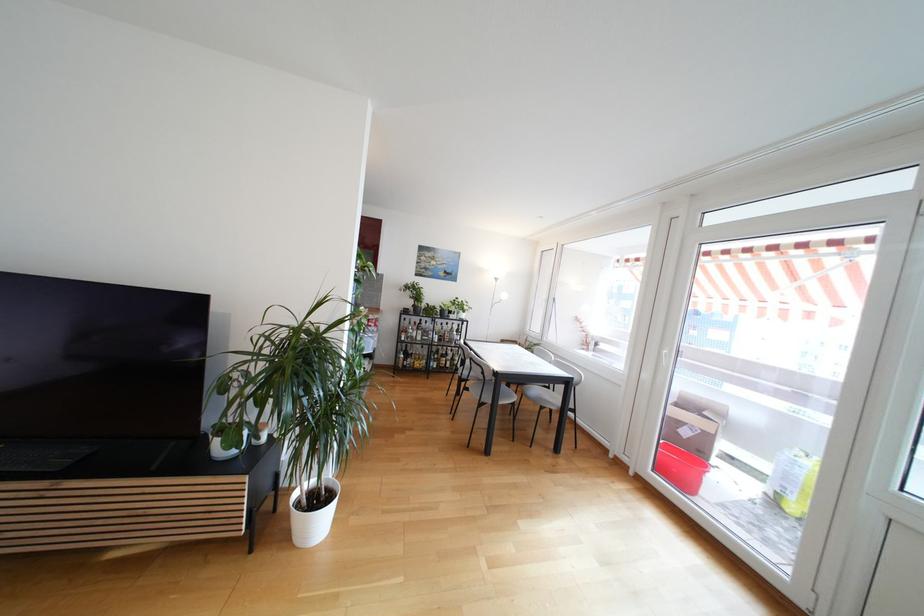
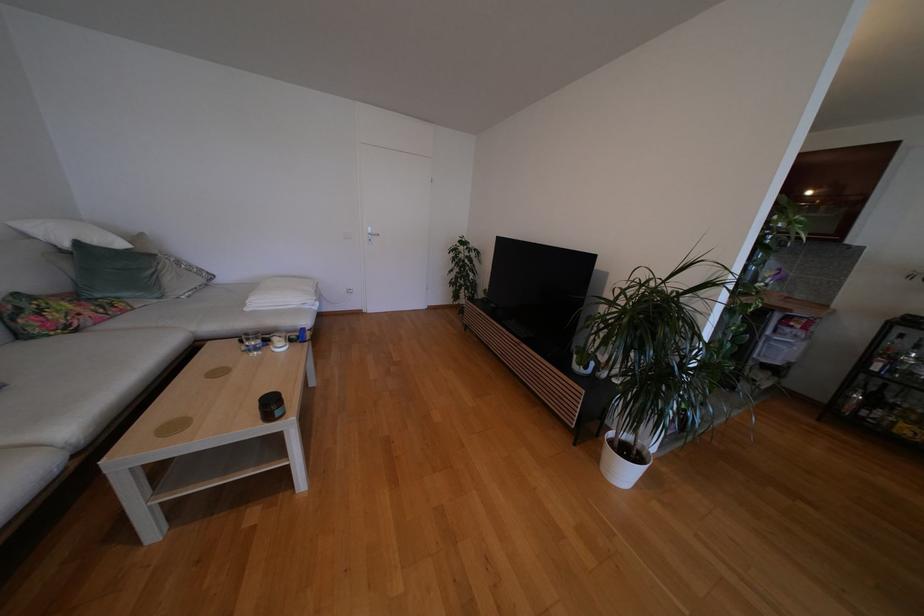
Question: The first image is from the beginning of the video and the second image is from the end. How did the camera likely rotate when shooting the video?

Choices:
 (A) Left
 (B) Right
 (C) Up
 (D) Down

Answer: (A)